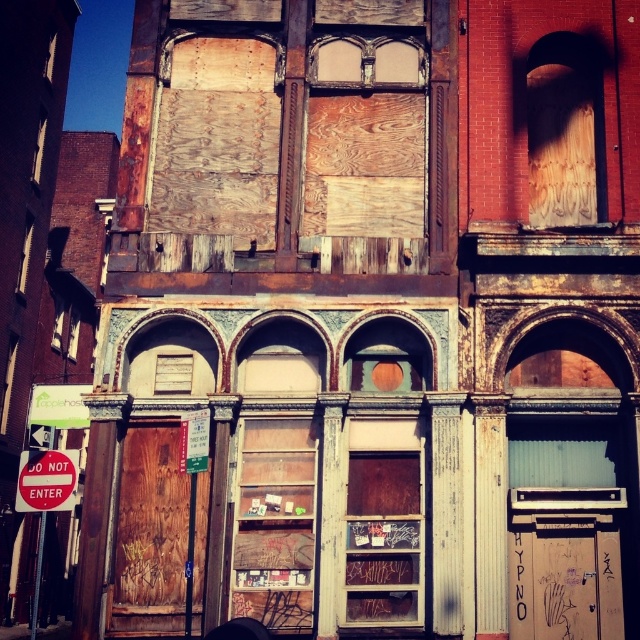
You are a delivery person with a cart that is 2 meters wide. You need to navigate between the red matte sign at lower left and the green plastic sign at center. Can your cart fit through the space between them?

The red matte sign at lower left and green plastic sign at center are 1.90 meters apart from each other. Since the cart is 2 meters wide, it cannot fit through the space between them.